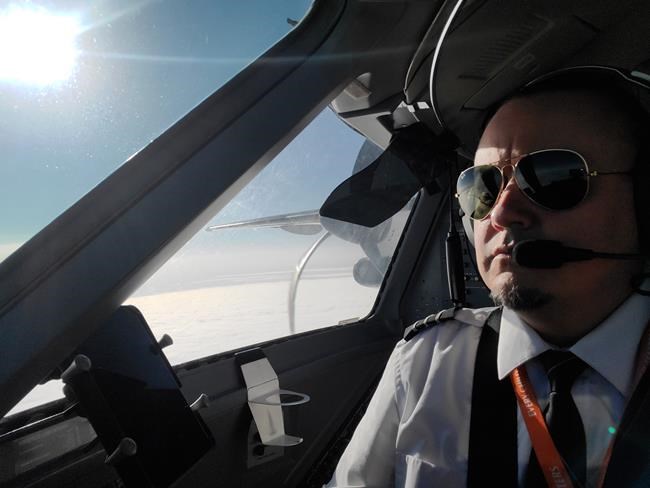
The height and width of the screenshot is (488, 650). I want to click on drink holder, so click(283, 398).